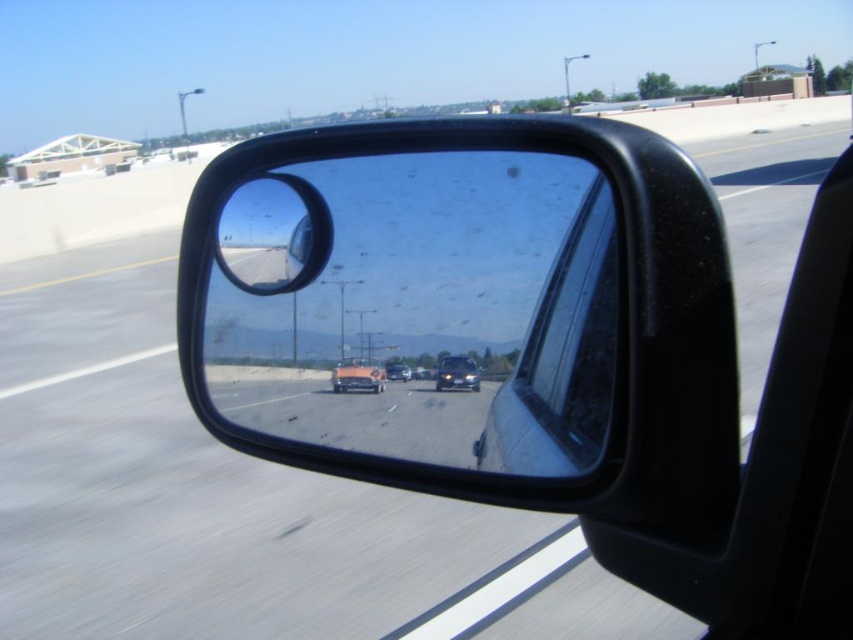
You are driving a car and want to check the blind spot using the clear plastic mirror at center and the shiny orange car at center. Which object will show a wider field of view for the driver?

The clear plastic mirror at center has a larger size compared to the shiny orange car at center, so it will provide a wider field of view for the driver.

You are driving a car and notice two objects in your side mirror. The clear plastic mirror at center and the shiny orange car at center. Which object is positioned higher in the mirror?

The clear plastic mirror at center is above the shiny orange car at center in the mirror.

You are driving a car and need to check the side mirror to change lanes. The clear plastic mirror at center and the shiny orange car at center are both in your view. Which object is wider?

The clear plastic mirror at center is wider than the shiny orange car at center according to the description.